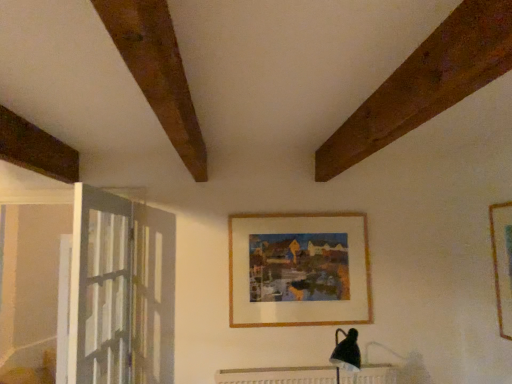
At what (x,y) coordinates should I click in order to perform the action: click on wooden framed painting at center. Please return your answer as a coordinate pair (x, y). The height and width of the screenshot is (384, 512). Looking at the image, I should click on (298, 270).

What do you see at coordinates (298, 270) in the screenshot?
I see `wooden framed painting at center` at bounding box center [298, 270].

Where is `wooden framed painting at center`? wooden framed painting at center is located at coordinates (298, 270).